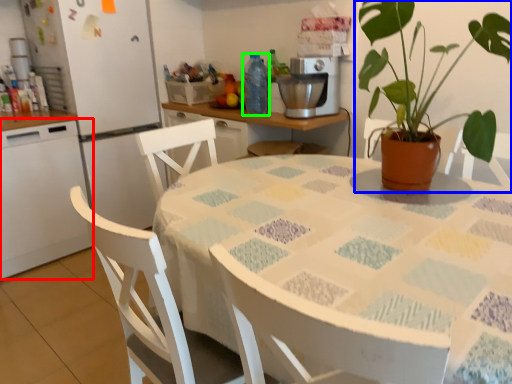
Question: Based on their relative distances, which object is farther from kitchen appliance (highlighted by a red box)? Choose from houseplant (highlighted by a blue box) and bottle (highlighted by a green box).

Choices:
 (A) houseplant
 (B) bottle

Answer: (A)